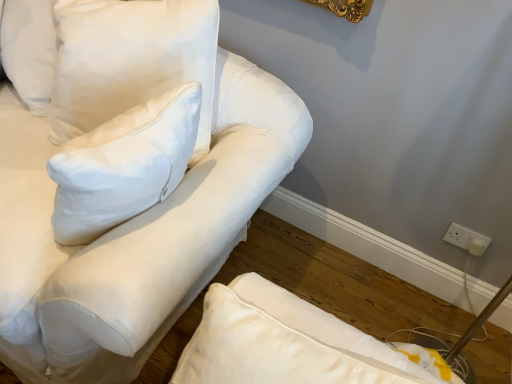
Question: Is white plastic socket at lower right wider or thinner than white cotton pillow at upper left, the 2th pillow from the left?

Choices:
 (A) thin
 (B) wide

Answer: (A)

Question: Considering the relative positions of white plastic socket at lower right and white cotton pillow at upper left, the 2th pillow from the left, in the image provided, is white plastic socket at lower right to the left or to the right of white cotton pillow at upper left, the 2th pillow from the left,?

Choices:
 (A) left
 (B) right

Answer: (B)

Question: Considering the real-world distances, which object is closest to the white cotton pillow at upper left, the first pillow when ordered from left to right?

Choices:
 (A) white plastic socket at lower right
 (B) white cotton sofa at upper left
 (C) white cotton pillow at upper left, the 2th pillow from the left

Answer: (C)

Question: Estimate the real-world distances between objects in this image. Which object is closer to the white plastic socket at lower right?

Choices:
 (A) white cotton sofa at upper left
 (B) white cotton pillow at upper left, the first pillow positioned from the right
 (C) white cotton pillow at upper left, the first pillow when ordered from left to right

Answer: (A)